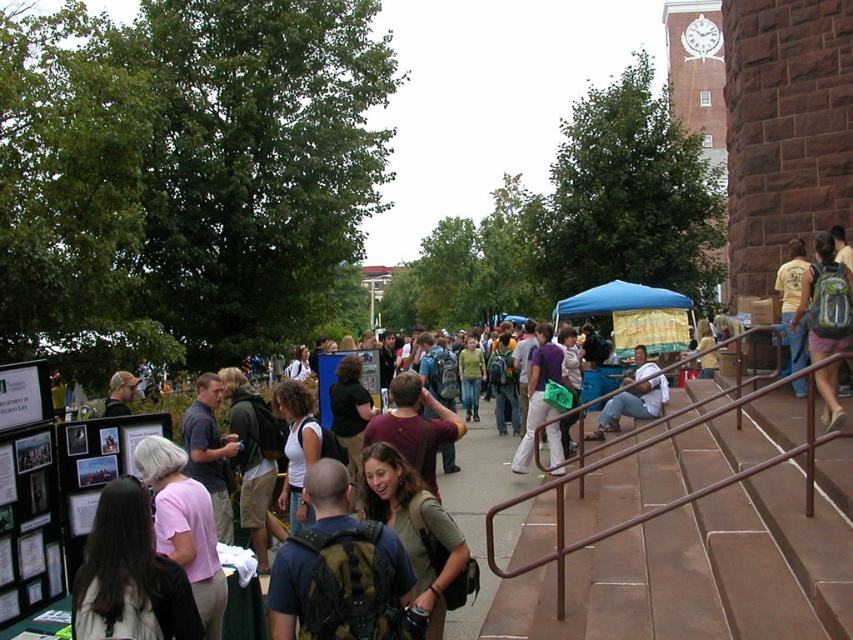
You are a student carrying a dark brown backpack at lower left and need to place it next to the matte purple shirt at center. Considering their sizes, will the backpack fit comfortably without overlapping the shirt?

The dark brown backpack at lower left is smaller than the matte purple shirt at center, so it can be placed next to it without overlapping.

You are a student carrying the dark brown backpack at lower left and need to fit it into a locker that can only accommodate items thinner than the matte purple shirt at center. Will the backpack fit?

The dark brown backpack at lower left is thinner than the matte purple shirt at center, so it will fit into the locker.

You are standing at the center of the campus and want to take a photo of the point marked at coordinates (90,538). If the camera you have can focus up to 12 meters away, will you be able to capture the point clearly?

The distance of point (90,538) from viewer is 13.22 meters, which is beyond the camera focus limit of 12 meters. Therefore, you won